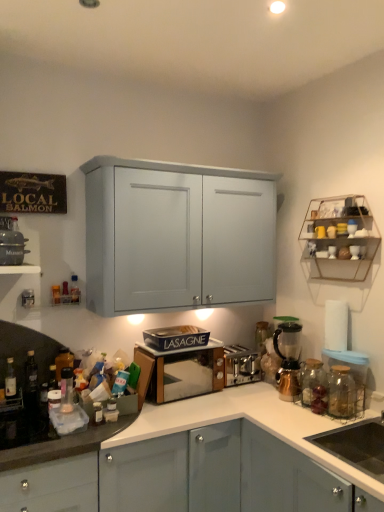
Find the location of a particular element. The width and height of the screenshot is (384, 512). metallic wire rack at upper right is located at coordinates (339, 238).

Describe the element at coordinates (241, 365) in the screenshot. I see `satin silver toaster at center, which appears as the first appliance when viewed from the back` at that location.

Describe the element at coordinates (185, 371) in the screenshot. I see `wooden microwave at center, positioned as the 2th appliance in front-to-back order` at that location.

This screenshot has width=384, height=512. What do you see at coordinates (75, 289) in the screenshot?
I see `translucent plastic bottle at center, which appears as the second bottle when viewed from the right` at bounding box center [75, 289].

In order to click on metallic wire rack at upper right in this screenshot , I will do `click(339, 238)`.

What's the angular difference between satin silver toaster at center, which ranks as the 3th appliance in front-to-back order, and transparent glass jar at right, which is the 1th glass jar from front to back,'s facing directions?

satin silver toaster at center, which ranks as the 3th appliance in front-to-back order, and transparent glass jar at right, which is the 1th glass jar from front to back, are facing 87 degrees away from each other.

Identify the location of the 2nd glass jar counting from the right side of the satin silver toaster at center, the third appliance viewed from the top. (341, 392).

From the image's perspective, which is below, satin silver toaster at center, which ranks as the 3th appliance in front-to-back order, or transparent glass jar at right, acting as the first glass jar starting from the right?

From the image's view, satin silver toaster at center, which ranks as the 3th appliance in front-to-back order, is below.

Does point (226, 368) appear closer or farther from the camera than point (353, 400)?

Clearly, point (226, 368) is more distant from the camera than point (353, 400).

Considering the relative sizes of metallic wire rack at upper right and translucent plastic bottle at left, acting as the 4th bottle starting from the front, in the image provided, is metallic wire rack at upper right taller than translucent plastic bottle at left, acting as the 4th bottle starting from the front,?

Yes, metallic wire rack at upper right is taller than translucent plastic bottle at left, acting as the 4th bottle starting from the front.

Image resolution: width=384 pixels, height=512 pixels. Find the location of `the 2nd bottle below the metallic wire rack at upper right (from the image's perspective)`. the 2nd bottle below the metallic wire rack at upper right (from the image's perspective) is located at coordinates (63, 362).

From the image's perspective, which one is positioned lower, metallic wire rack at upper right or translucent plastic bottle at left, which ranks as the third bottle in right-to-left order?

translucent plastic bottle at left, which ranks as the third bottle in right-to-left order, is shown below in the image.

Is black glass bottle at left, the 2th bottle when ordered from left to right, turned away from wooden microwave at center, acting as the 2th appliance starting from the top?

No, black glass bottle at left, the 2th bottle when ordered from left to right, is not facing the opposite direction of wooden microwave at center, acting as the 2th appliance starting from the top.

Are black glass bottle at left, marked as the 2th bottle in a front-to-back arrangement, and wooden microwave at center, the 2th appliance from the right, far apart?

No, black glass bottle at left, marked as the 2th bottle in a front-to-back arrangement, is not far from wooden microwave at center, the 2th appliance from the right.

From a real-world perspective, starting from the wooden microwave at center, which is the 2th appliance in back-to-front order, which bottle is the 3rd one vertically above it? Please provide its 2D coordinates.

[(30, 382)]

Can you confirm if black glass bottle at left, marked as the 2th bottle in a front-to-back arrangement, is thinner than wooden microwave at center, which appears as the second appliance when viewed from the left?

Correct, the width of black glass bottle at left, marked as the 2th bottle in a front-to-back arrangement, is less than that of wooden microwave at center, which appears as the second appliance when viewed from the left.

From a real-world perspective, is transparent glass jar at right, acting as the first glass jar starting from the right, beneath translucent plastic bottle at center, which appears as the 5th bottle when viewed from the front?

Yes, from a real-world perspective, transparent glass jar at right, acting as the first glass jar starting from the right, is under translucent plastic bottle at center, which appears as the 5th bottle when viewed from the front.

Is transparent glass jar at right, the second glass jar in the back-to-front sequence, aimed at translucent plastic bottle at center, which appears as the second bottle when viewed from the right?

No, transparent glass jar at right, the second glass jar in the back-to-front sequence, is not aimed at translucent plastic bottle at center, which appears as the second bottle when viewed from the right.

Looking at this image, measure the distance between transparent glass jar at right, the second glass jar in the back-to-front sequence, and translucent plastic bottle at center, the 4th bottle when ordered from left to right.

1.47 meters.

Considering the sizes of objects transparent glass jar at right, which is the 1th glass jar from front to back, and translucent plastic bottle at center, the 4th bottle when ordered from left to right, in the image provided, who is wider, transparent glass jar at right, which is the 1th glass jar from front to back, or translucent plastic bottle at center, the 4th bottle when ordered from left to right,?

Wider between the two is transparent glass jar at right, which is the 1th glass jar from front to back.

Which of these two, black glass bottle at left, the 2th bottle when ordered from left to right, or satin silver toaster at center, marked as the 1th appliance in a right-to-left arrangement, is bigger?

satin silver toaster at center, marked as the 1th appliance in a right-to-left arrangement, is bigger.

From a real-world perspective, who is located lower, black glass bottle at left, positioned as the 4th bottle in right-to-left order, or satin silver toaster at center, which appears as the first appliance when viewed from the back?

satin silver toaster at center, which appears as the first appliance when viewed from the back, from a real-world perspective.

Does point (27, 382) appear closer or farther from the camera than point (249, 361)?

Point (27, 382).

Find the location of `the 2nd appliance positioned below the black glass bottle at left, the 2th bottle when ordered from left to right (from a real-world perspective)`. the 2nd appliance positioned below the black glass bottle at left, the 2th bottle when ordered from left to right (from a real-world perspective) is located at coordinates click(241, 365).

Which is in front, translucent plastic bottle at center, which appears as the 5th bottle when viewed from the front, or metallic wire rack at upper right?

metallic wire rack at upper right is in front.

Is metallic wire rack at upper right at the back of translucent plastic bottle at center, which appears as the second bottle when viewed from the right?

That's not correct — translucent plastic bottle at center, which appears as the second bottle when viewed from the right, is not looking away from metallic wire rack at upper right.

From a real-world perspective, which is physically below, translucent plastic bottle at center, the 4th bottle when ordered from left to right, or metallic wire rack at upper right?

translucent plastic bottle at center, the 4th bottle when ordered from left to right, is physically lower.

From the image's perspective, which one is positioned lower, translucent plastic bottle at center, which appears as the second bottle when viewed from the right, or metallic wire rack at upper right?

From the image's view, translucent plastic bottle at center, which appears as the second bottle when viewed from the right, is below.

In terms of height, does wooden microwave at center, which is the 2th appliance from bottom to top, look taller or shorter compared to translucent plastic bottle at lower left, the fifth bottle in the left-to-right sequence?

wooden microwave at center, which is the 2th appliance from bottom to top, is taller than translucent plastic bottle at lower left, the fifth bottle in the left-to-right sequence.

In terms of width, does wooden microwave at center, acting as the 2th appliance starting from the top, look wider or thinner when compared to translucent plastic bottle at lower left, which is counted as the 1th bottle, starting from the front?

Clearly, wooden microwave at center, acting as the 2th appliance starting from the top, has more width compared to translucent plastic bottle at lower left, which is counted as the 1th bottle, starting from the front.

Between point (177, 364) and point (67, 402), which one is positioned behind?

The point (177, 364) is farther from the camera.

In the scene shown: Considering the positions of objects wooden microwave at center, which appears as the second appliance when viewed from the left, and translucent plastic bottle at lower left, the 5th bottle when ordered from back to front, in the image provided, who is behind, wooden microwave at center, which appears as the second appliance when viewed from the left, or translucent plastic bottle at lower left, the 5th bottle when ordered from back to front,?

wooden microwave at center, which appears as the second appliance when viewed from the left, is behind.

This screenshot has width=384, height=512. In the image, there is a transparent glass jar at right, which is the 1th glass jar from front to back. Find the location of `appliance below it (from a real-world perspective)`. appliance below it (from a real-world perspective) is located at coordinates (241, 365).

Where is `shelf on the right of translucent plastic bottle at left, which ranks as the third bottle in right-to-left order`? shelf on the right of translucent plastic bottle at left, which ranks as the third bottle in right-to-left order is located at coordinates (339, 238).

Based on the photo, from the image, which object appears to be nearer to translucent plastic bottle at lower left, the 5th bottle when ordered from back to front, translucent plastic bottle at left, positioned as the 5th bottle in right-to-left order, or metallic copper coffee machine at right?

translucent plastic bottle at left, positioned as the 5th bottle in right-to-left order, is positioned closer to the anchor translucent plastic bottle at lower left, the 5th bottle when ordered from back to front.

Which object lies further to the anchor point translucent glass jar at right, placed as the second glass jar when sorted from right to left, translucent plastic bottle at center, which appears as the second bottle when viewed from the right, or matte black pot at left, placed as the first appliance when sorted from left to right?

matte black pot at left, placed as the first appliance when sorted from left to right, is further to translucent glass jar at right, placed as the second glass jar when sorted from right to left.

Which object lies nearer to the anchor point translucent glass jar at right, positioned as the second glass jar in front-to-back order, black glass bottle at left, positioned as the 4th bottle in right-to-left order, or metallic copper coffee machine at right?

Among the two, metallic copper coffee machine at right is located nearer to translucent glass jar at right, positioned as the second glass jar in front-to-back order.

Based on their spatial positions, is translucent plastic bottle at lower left, the fifth bottle in the left-to-right sequence, or metallic wire rack at upper right further from translucent glass jar at right, positioned as the second glass jar in front-to-back order?

Based on the image, translucent plastic bottle at lower left, the fifth bottle in the left-to-right sequence, appears to be further to translucent glass jar at right, positioned as the second glass jar in front-to-back order.

Based on the photo, looking at the image, which one is located further to translucent plastic bottle at lower left, which is the first bottle in right-to-left order, translucent plastic bottle at center, the 4th bottle when ordered from left to right, or black glass bottle at left, positioned as the 4th bottle in right-to-left order?

translucent plastic bottle at center, the 4th bottle when ordered from left to right, lies further to translucent plastic bottle at lower left, which is the first bottle in right-to-left order, than the other object.

Looking at the image, which one is located further to translucent plastic bottle at center, which appears as the 5th bottle when viewed from the front, wooden microwave at center, positioned as the 2th appliance in front-to-back order, or satin silver toaster at center, arranged as the 3th appliance when viewed from the left?

Based on the image, satin silver toaster at center, arranged as the 3th appliance when viewed from the left, appears to be further to translucent plastic bottle at center, which appears as the 5th bottle when viewed from the front.

From the image, which object appears to be farther from transparent glass jar at right, which is the 1th glass jar from front to back, black matte sink at lower right or translucent glass jar at right, arranged as the first glass jar when viewed from the left?

black matte sink at lower right is further to transparent glass jar at right, which is the 1th glass jar from front to back.

Which object lies nearer to the anchor point transparent glass jar at right, arranged as the second glass jar when viewed from the left, white matte paper towel at right or black glass bottle at left, positioned as the 4th bottle in right-to-left order?

white matte paper towel at right is closer to transparent glass jar at right, arranged as the second glass jar when viewed from the left.

I want to click on coffee machine between metallic wire rack at upper right and transparent glass jar at right, arranged as the second glass jar when viewed from the left, vertically, so click(288, 360).

At what (x,y) coordinates should I click in order to perform the action: click on coffee machine between transparent glass jar at right, the second glass jar in the back-to-front sequence, and satin silver toaster at center, which appears as the first appliance when viewed from the back, in the front-back direction. Please return your answer as a coordinate pair (x, y). Looking at the image, I should click on (288, 360).

Find the location of `bottle between translucent plastic bottle at center, the 4th bottle when ordered from left to right, and wooden microwave at center, which is the 2th appliance in back-to-front order, from left to right`. bottle between translucent plastic bottle at center, the 4th bottle when ordered from left to right, and wooden microwave at center, which is the 2th appliance in back-to-front order, from left to right is located at coordinates (66, 390).

This screenshot has height=512, width=384. I want to click on sink between translucent plastic bottle at lower left, which is counted as the 1th bottle, starting from the front, and metallic wire rack at upper right, so click(x=356, y=445).